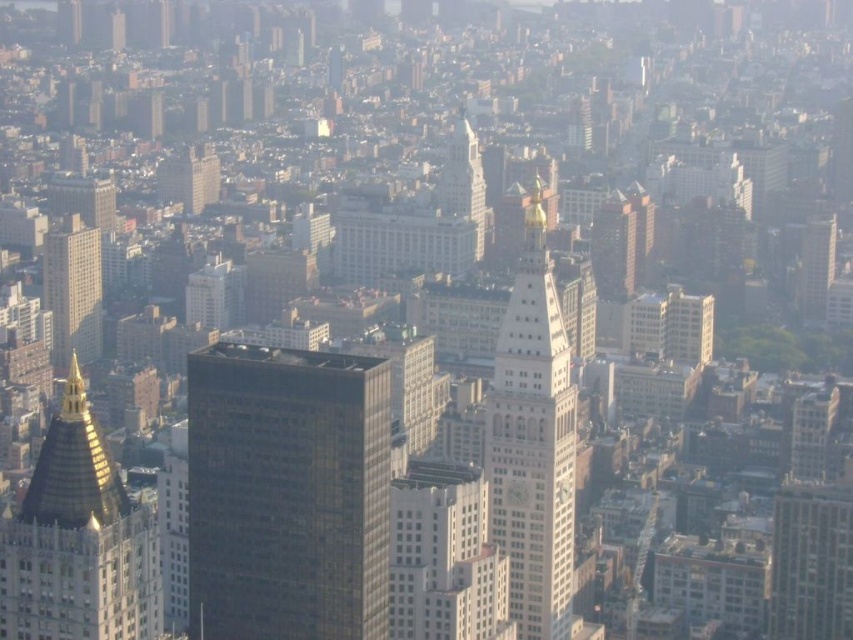
You are a drone operator tasked with capturing aerial footage of the city. You need to ensure that both the gold metallic dome at left and the matte gray skyscraper at left are visible in your shot. Based on their positions, which object appears lower in the frame?

The gold metallic dome at left appears lower in the frame because it is positioned below the matte gray skyscraper at left.

You are a drone operator who needs to capture a photo of the gold metallic dome at left from your current position. The camera on your drone has a maximum range of 600 meters. Can you successfully take the photo without moving closer?

The gold metallic dome at left and camera are 665.83 meters apart, which exceeds the camera maximum range of 600 meters. Therefore, you cannot take the photo without moving closer.